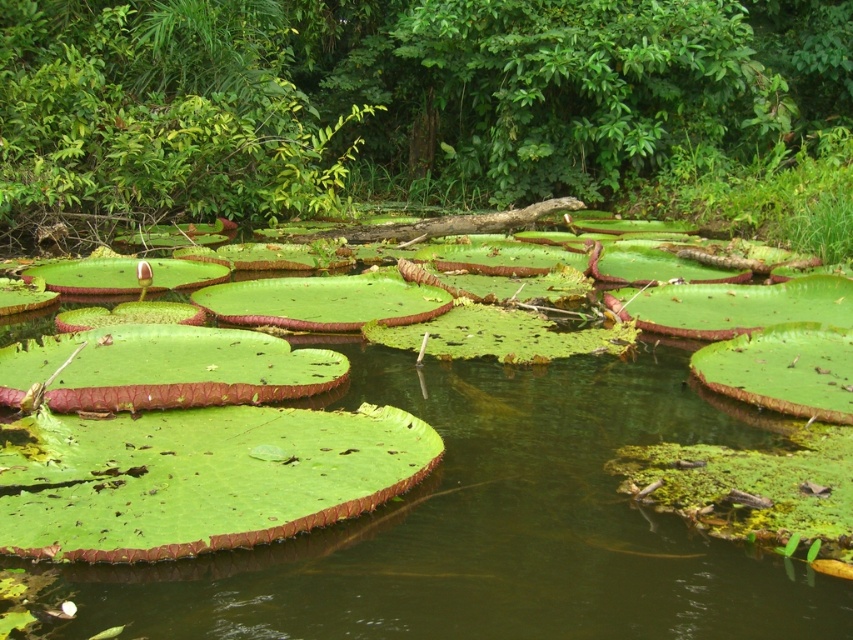
Question: Observing the image, what is the correct spatial positioning of green leathery leaves at center in reference to green leafy water at center?

Choices:
 (A) above
 (B) below

Answer: (A)

Question: Is green leathery leaves at center bigger than green leafy water at center?

Choices:
 (A) no
 (B) yes

Answer: (B)

Question: Can you confirm if green leathery leaves at center is smaller than green leafy water at center?

Choices:
 (A) no
 (B) yes

Answer: (A)

Question: Which point is closer to the camera?

Choices:
 (A) green leafy water at center
 (B) green leathery leaves at center

Answer: (A)